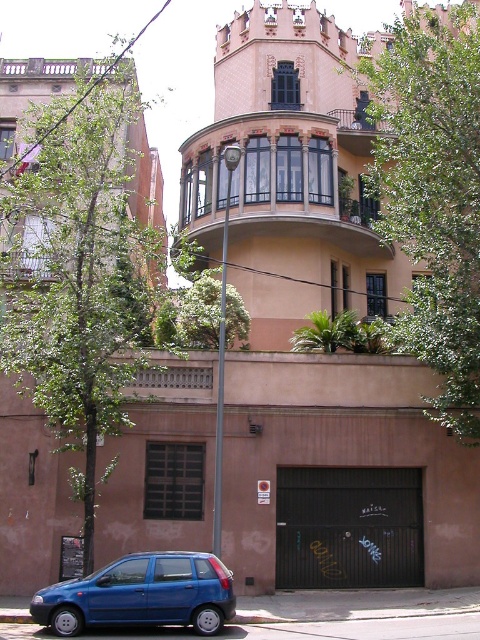
Does green leafy tree at upper left have a greater width compared to green leafy tree at upper center?

Yes, green leafy tree at upper left is wider than green leafy tree at upper center.

Can you confirm if green leafy tree at upper left is bigger than green leafy tree at upper center?

Indeed, green leafy tree at upper left has a larger size compared to green leafy tree at upper center.

Is point (144, 333) more distant than point (439, 60)?

Yes, point (144, 333) is behind point (439, 60).

This screenshot has width=480, height=640. Find the location of `green leafy tree at upper left`. green leafy tree at upper left is located at coordinates (82, 266).

Can you confirm if green leafy tree at upper center is wider than matte black balcony at center?

In fact, green leafy tree at upper center might be narrower than matte black balcony at center.

Is green leafy tree at upper center to the left of matte black balcony at center from the viewer's perspective?

Incorrect, green leafy tree at upper center is not on the left side of matte black balcony at center.

Find the location of a particular element. The image size is (480, 640). green leafy tree at upper center is located at coordinates (432, 195).

Does matte black balcony at center have a larger size compared to metallic blue hatchback at lower left?

Indeed, matte black balcony at center has a larger size compared to metallic blue hatchback at lower left.

Does matte black balcony at center appear over metallic blue hatchback at lower left?

Yes.

Locate an element on the screen. This screenshot has height=640, width=480. matte black balcony at center is located at coordinates (274, 180).